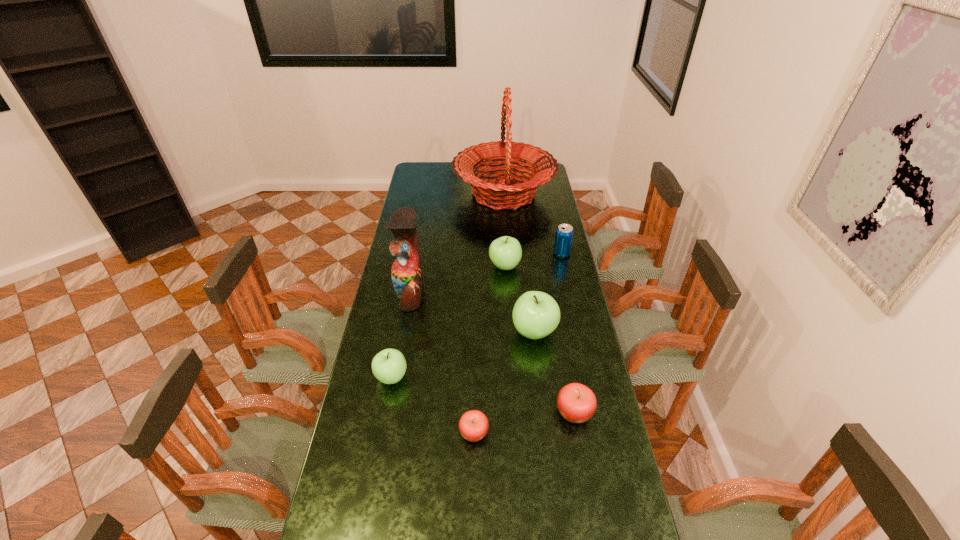
The image size is (960, 540). Identify the location of the closest object relative to the pop soda. (505, 252).

Select which object appears as the fifth closest to the parrot. Please provide its 2D coordinates. Your answer should be formatted as a tuple, i.e. [(x, y)], where the tuple contains the x and y coordinates of a point satisfying the conditions above.

[(473, 425)]

You are a GUI agent. You are given a task and a screenshot of the screen. Output one action in this format:
    pyautogui.click(x=<x>, y=<y>)
    Task: Click on the apple that is the second closest to the shortest apple
    This screenshot has width=960, height=540.
    Given the screenshot: What is the action you would take?
    pyautogui.click(x=577, y=403)

Image resolution: width=960 pixels, height=540 pixels. What are the coordinates of `the second closest apple to the nearest green apple` in the screenshot? It's located at (536, 314).

Locate an element on the screen. green apple that can be found as the closest to the second nearest green apple is located at coordinates (505, 252).

Locate an element on the screen. This screenshot has width=960, height=540. green apple identified as the third closest to the basket is located at coordinates coord(389,366).

Identify the location of vacant space that satisfies the following two spatial constraints: 1. at the face of the second tallest object; 2. on the right side of the bigger red apple. This screenshot has height=540, width=960. (389, 413).

The image size is (960, 540). In order to click on free spot that satisfies the following two spatial constraints: 1. on the back side of the bigger red apple; 2. on the left side of the pop soda in this screenshot , I will do `click(545, 254)`.